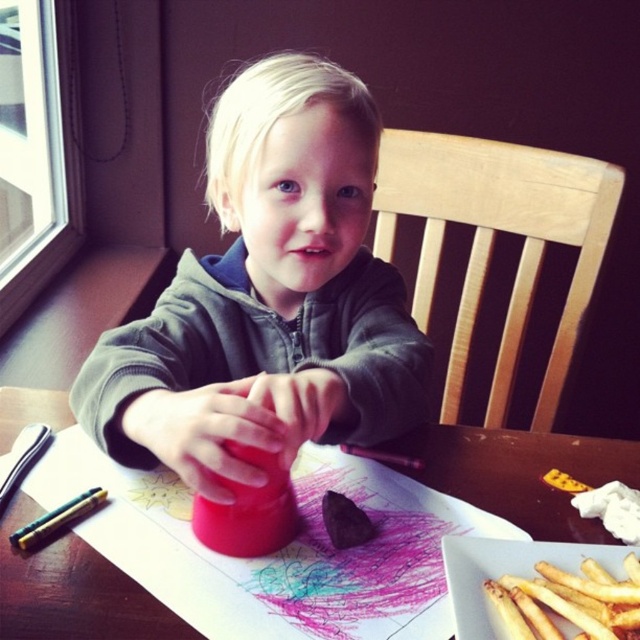
What are the coordinates of the matte plastic table at center?

The coordinates of the matte plastic table at center are at point (520, 474).

You are a parent checking on your child. You see the matte plastic cup at center and the matte plastic table at center. Which object is bigger in size?

The matte plastic cup at center is larger in size compared to the matte plastic table at center.